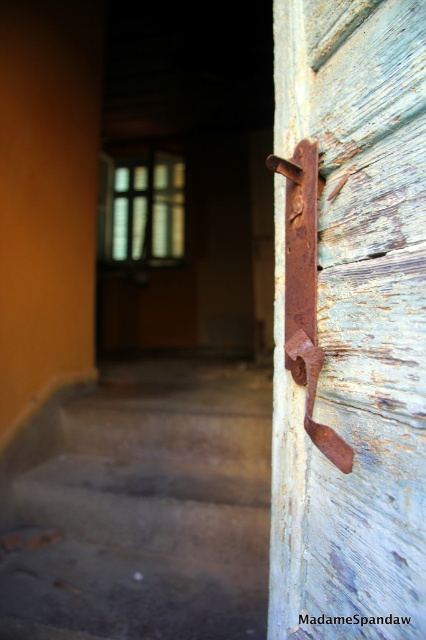
Question: Does rusty metal handle at right lie in front of concrete stairs at lower left?

Choices:
 (A) no
 (B) yes

Answer: (B)

Question: Which object is positioned closest to the rusty metal door handle at right?

Choices:
 (A) concrete stairs at lower left
 (B) rusty metal handle at right

Answer: (B)

Question: Among these points, which one is nearest to the camera?

Choices:
 (A) (230, 602)
 (B) (379, 116)

Answer: (B)

Question: Is concrete stairs at lower left bigger than rusty metal door handle at right?

Choices:
 (A) yes
 (B) no

Answer: (A)

Question: Which object is positioned farthest from the rusty metal handle at right?

Choices:
 (A) concrete stairs at lower left
 (B) rusty metal door handle at right

Answer: (A)

Question: In this image, where is rusty metal handle at right located relative to concrete stairs at lower left?

Choices:
 (A) above
 (B) below

Answer: (A)